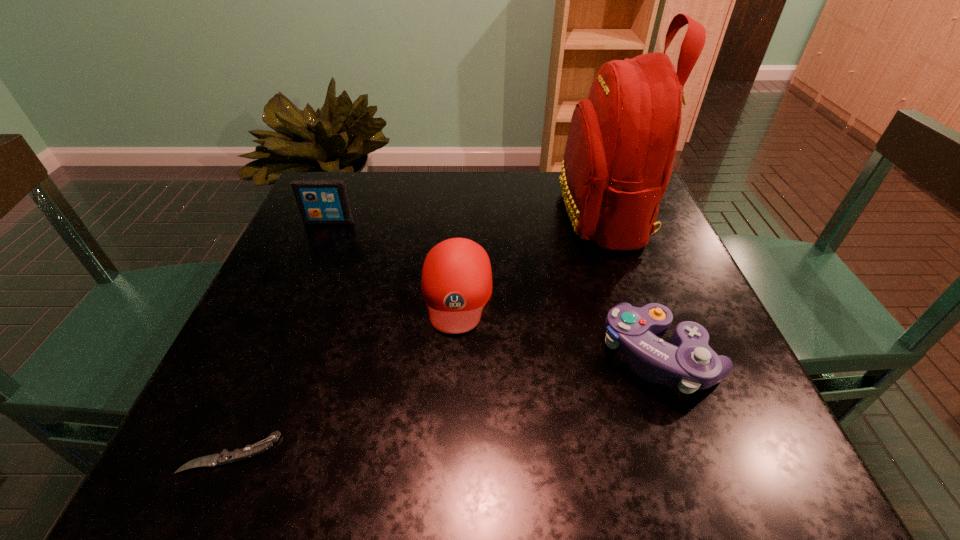
The image size is (960, 540). I want to click on vacant space that satisfies the following two spatial constraints: 1. on the front screen of the iPod; 2. on the right side of the control, so click(x=272, y=356).

Image resolution: width=960 pixels, height=540 pixels. Find the location of `free space that satisfies the following two spatial constraints: 1. on the front-facing side of the tallest object; 2. on the front-facing side of the third object from right to left`. free space that satisfies the following two spatial constraints: 1. on the front-facing side of the tallest object; 2. on the front-facing side of the third object from right to left is located at coordinates (631, 292).

Find the location of a particular element. vacant region that satisfies the following two spatial constraints: 1. on the front-facing side of the backpack; 2. on the front-facing side of the baseball cap is located at coordinates (x=631, y=292).

Identify the location of free location that satisfies the following two spatial constraints: 1. on the front screen of the iPod; 2. on the left side of the pocketknife. Image resolution: width=960 pixels, height=540 pixels. (230, 453).

The width and height of the screenshot is (960, 540). Identify the location of free region that satisfies the following two spatial constraints: 1. on the front screen of the control; 2. on the left side of the iPod. (272, 356).

At what (x,y) coordinates should I click in order to perform the action: click on free region that satisfies the following two spatial constraints: 1. on the front screen of the control; 2. on the left side of the iPod. Please return your answer as a coordinate pair (x, y). The height and width of the screenshot is (540, 960). Looking at the image, I should click on (272, 356).

Identify the location of blank space that satisfies the following two spatial constraints: 1. on the front-facing side of the backpack; 2. on the front-facing side of the baseball cap. (631, 292).

The image size is (960, 540). Find the location of `vacant space that satisfies the following two spatial constraints: 1. on the front-facing side of the third object from right to left; 2. on the left side of the control`. vacant space that satisfies the following two spatial constraints: 1. on the front-facing side of the third object from right to left; 2. on the left side of the control is located at coordinates (453, 356).

The image size is (960, 540). In order to click on vacant area in the image that satisfies the following two spatial constraints: 1. on the front-facing side of the backpack; 2. on the front-facing side of the third object from left to right in this screenshot , I will do `click(631, 292)`.